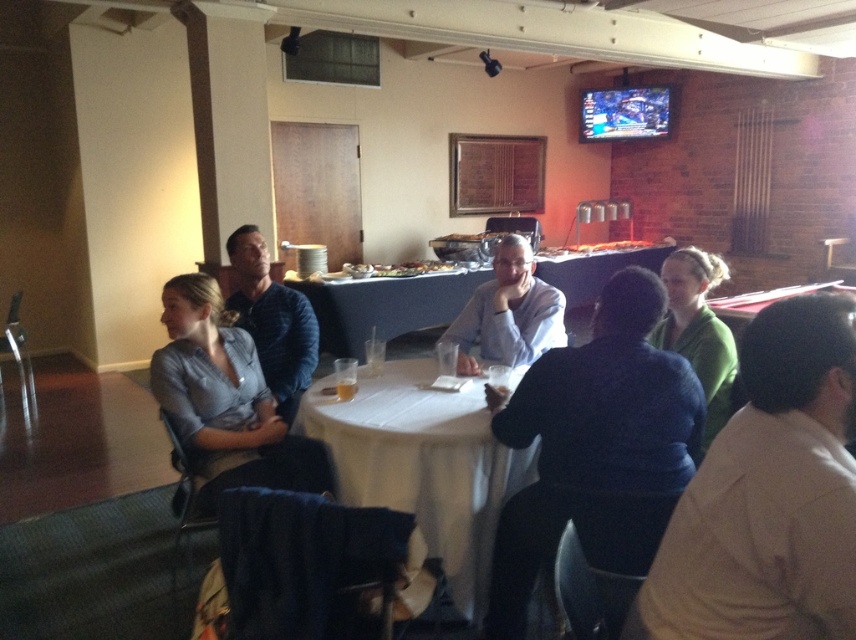
Question: Which object is closer to the camera taking this photo?

Choices:
 (A) white tablecloth at center
 (B) matte gray shirt at center
 (C) white shirt at lower right

Answer: (C)

Question: Which point is farther to the camera?

Choices:
 (A) white cloth-covered table at center
 (B) gray sweater at center

Answer: (B)

Question: Does blue striped polo shirt at center appear over green matte sweater at upper right?

Choices:
 (A) yes
 (B) no

Answer: (B)

Question: Where is white cloth-covered table at center located in relation to matte gray shirt at center in the image?

Choices:
 (A) below
 (B) above

Answer: (A)

Question: Can you confirm if white shirt at lower right is positioned below white tablecloth at center?

Choices:
 (A) no
 (B) yes

Answer: (B)

Question: Which object is positioned closest to the white cloth-covered table at center?

Choices:
 (A) white tablecloth at center
 (B) gray sweater at center
 (C) white shirt at lower right

Answer: (B)